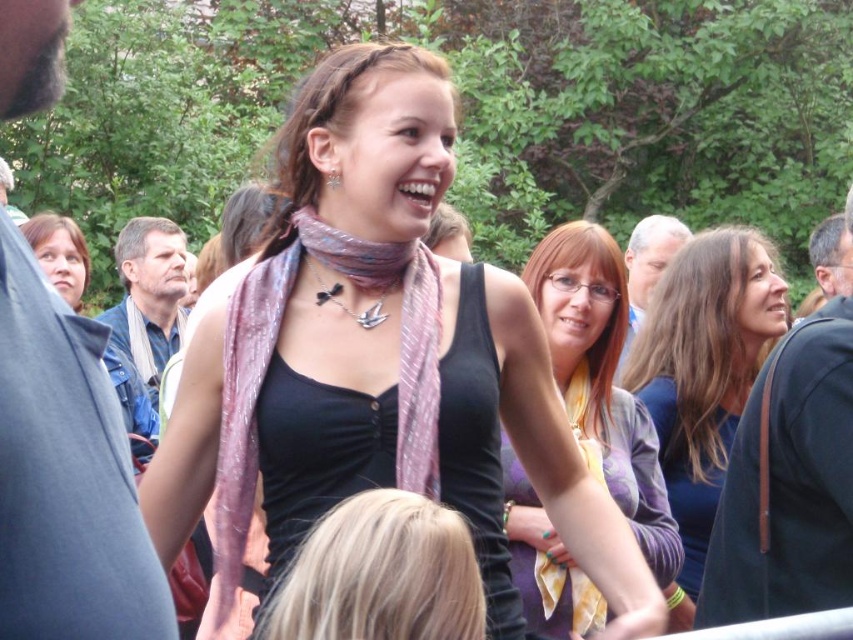
Measure the distance between point (764, 241) and camera.

They are 6.14 meters apart.

Locate an element on the screen. This screenshot has width=853, height=640. dark blue fabric at center is located at coordinates (703, 374).

Between point (728, 552) and point (703, 499), which one is positioned in front?

Point (728, 552) is in front.

Does dark blue shirt at right have a smaller size compared to purple satin dress at upper right?

No.

Which is behind, point (769, 609) or point (718, 445)?

Positioned behind is point (718, 445).

In order to click on dark blue shirt at right in this screenshot , I will do `click(788, 483)`.

Is purple satin dress at upper right below smooth gray hair at upper center?

Yes.

Between point (682, 436) and point (672, 234), which one is positioned behind?

Positioned behind is point (672, 234).

The width and height of the screenshot is (853, 640). What are the coordinates of `purple satin dress at upper right` in the screenshot? It's located at (688, 474).